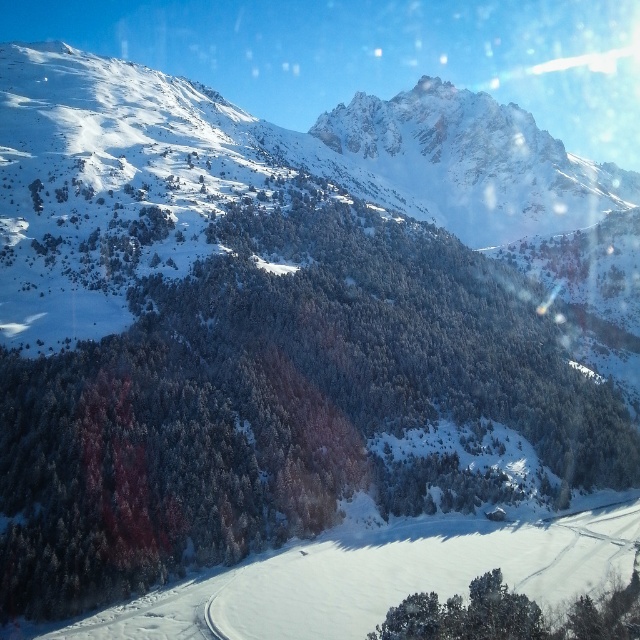
Question: Can you confirm if green matte tree at center is wider than snowy rocky mountain at upper center?

Choices:
 (A) no
 (B) yes

Answer: (A)

Question: Can you confirm if green matte tree at center is smaller than green matte tree at lower right?

Choices:
 (A) no
 (B) yes

Answer: (A)

Question: Which point is farther to the camera?

Choices:
 (A) green matte tree at lower right
 (B) green matte tree at center
 (C) snowy rocky mountain at upper center

Answer: (C)

Question: Does green matte tree at center have a smaller size compared to green matte tree at lower right?

Choices:
 (A) no
 (B) yes

Answer: (A)

Question: Among these objects, which one is nearest to the camera?

Choices:
 (A) green matte tree at center
 (B) green matte tree at lower right

Answer: (B)

Question: Estimate the real-world distances between objects in this image. Which object is closer to the green matte tree at center?

Choices:
 (A) snowy rocky mountain at upper center
 (B) green matte tree at lower right

Answer: (A)